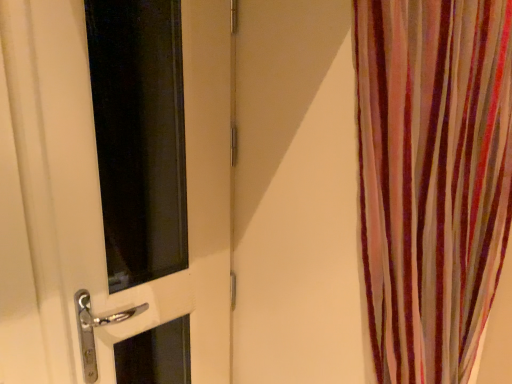
Question: Considering the positions of white glossy door at left and striped fabric curtain at right in the image, is white glossy door at left wider or thinner than striped fabric curtain at right?

Choices:
 (A) thin
 (B) wide

Answer: (A)

Question: Does point (112, 145) appear closer or farther from the camera than point (476, 228)?

Choices:
 (A) closer
 (B) farther

Answer: (B)

Question: Based on their sizes in the image, would you say white glossy door at left is bigger or smaller than striped fabric curtain at right?

Choices:
 (A) small
 (B) big

Answer: (A)

Question: Considering their positions, is striped fabric curtain at right located in front of or behind white glossy door at left?

Choices:
 (A) front
 (B) behind

Answer: (A)

Question: Considering the positions of striped fabric curtain at right and white glossy door at left in the image, is striped fabric curtain at right wider or thinner than white glossy door at left?

Choices:
 (A) thin
 (B) wide

Answer: (B)

Question: Does point tap(409, 64) appear closer or farther from the camera than point tap(72, 148)?

Choices:
 (A) farther
 (B) closer

Answer: (B)

Question: From a real-world perspective, is striped fabric curtain at right positioned above or below white glossy door at left?

Choices:
 (A) above
 (B) below

Answer: (A)